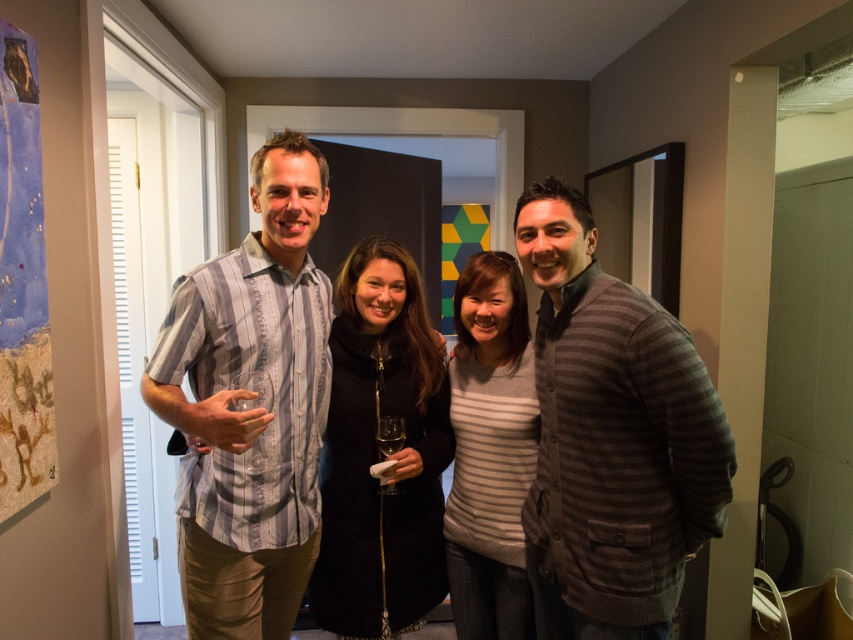
Between point (247, 438) and point (407, 376), which one is positioned behind?

Positioned behind is point (407, 376).

You are a GUI agent. You are given a task and a screenshot of the screen. Output one action in this format:
    pyautogui.click(x=<x>, y=<y>)
    Task: Click on the striped cotton shirt at left
    
    Given the screenshot: What is the action you would take?
    pyautogui.click(x=252, y=406)

Is dark gray striped sweater at right to the left of striped cotton shirt at left from the viewer's perspective?

In fact, dark gray striped sweater at right is to the right of striped cotton shirt at left.

Which of these two, dark gray striped sweater at right or striped cotton shirt at left, stands shorter?

With less height is dark gray striped sweater at right.

The width and height of the screenshot is (853, 640). Describe the element at coordinates (612, 436) in the screenshot. I see `dark gray striped sweater at right` at that location.

Locate an element on the screen. dark gray striped sweater at right is located at coordinates (612, 436).

Is striped cotton shirt at left wider than striped knit sweater at center?

Yes.

Is point (236, 522) less distant than point (476, 259)?

Yes, point (236, 522) is in front of point (476, 259).

Where is `striped cotton shirt at left`? The height and width of the screenshot is (640, 853). striped cotton shirt at left is located at coordinates (252, 406).

I want to click on striped cotton shirt at left, so click(252, 406).